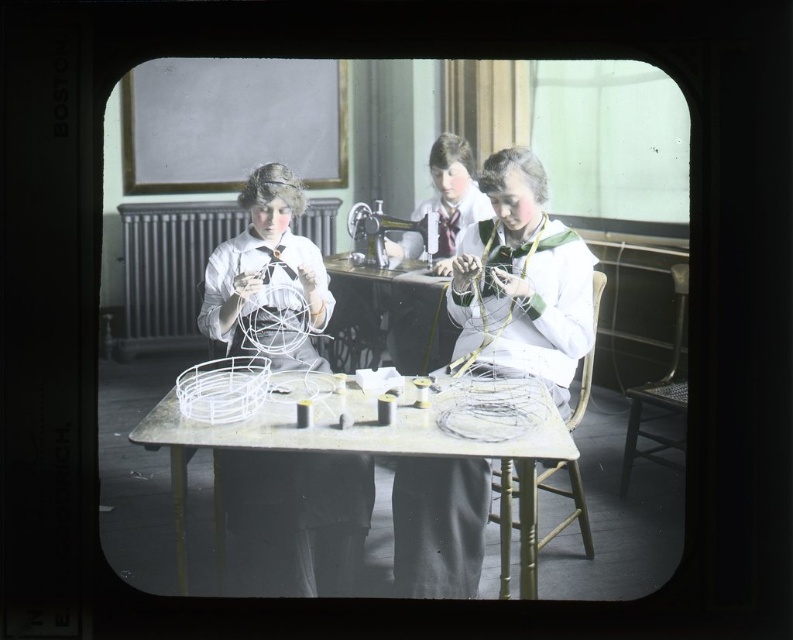
Question: Is white wire mesh table at center further to the viewer compared to white fabric dress at center?

Choices:
 (A) yes
 (B) no

Answer: (A)

Question: Which point is closer to the camera taking this photo?

Choices:
 (A) (454, 330)
 (B) (396, 364)
 (C) (272, 358)
 (D) (175, 472)

Answer: (D)

Question: Can you confirm if white matte wire basket at center is thinner than metallic silver sewing machine at center?

Choices:
 (A) yes
 (B) no

Answer: (B)

Question: Which is farther from the white matte wire basket at center?

Choices:
 (A) white wire basket at center
 (B) metallic silver sewing machine at center
 (C) white fabric dress at center
 (D) white wire mesh table at center

Answer: (B)

Question: Which point is farther to the camera?

Choices:
 (A) [374, 273]
 (B) [519, 516]
 (C) [374, 244]

Answer: (A)

Question: Does white matte wire basket at center appear on the right side of white wire basket at center?

Choices:
 (A) yes
 (B) no

Answer: (B)